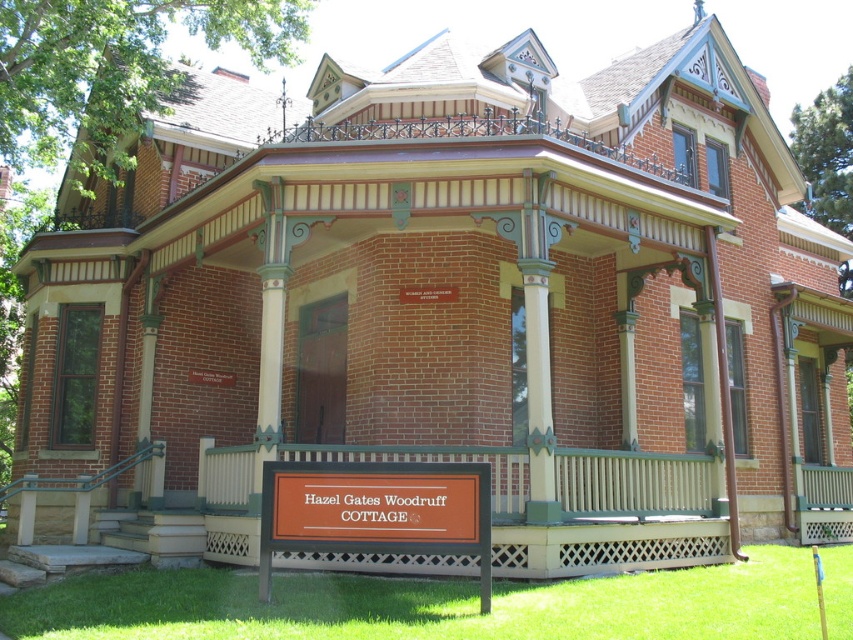
Between wooden porch at lower center and orange matte sign at lower center, which one is positioned higher?

orange matte sign at lower center is above.

The height and width of the screenshot is (640, 853). Identify the location of wooden porch at lower center. (579, 504).

This screenshot has height=640, width=853. What are the coordinates of `wooden porch at lower center` in the screenshot? It's located at (579, 504).